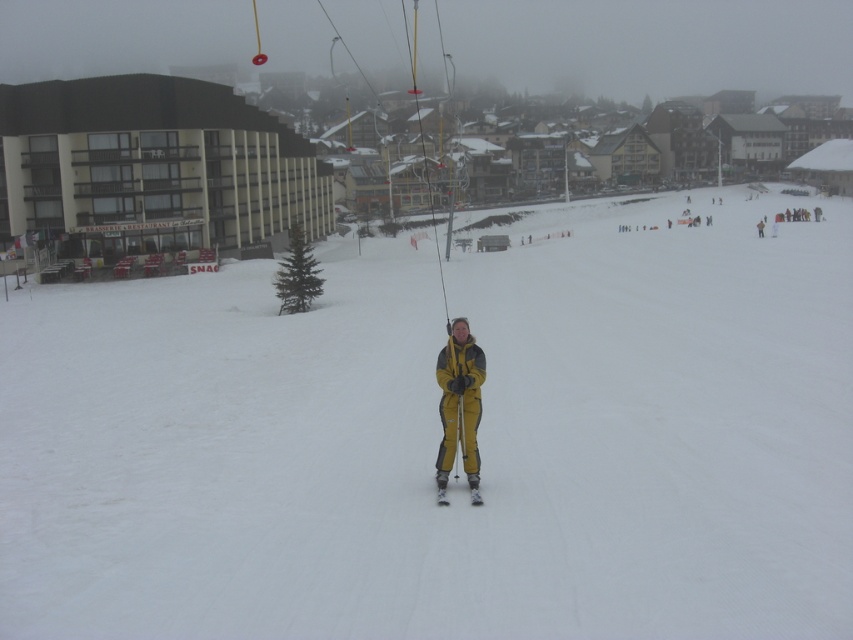
Question: Does beige concrete building at upper left have a lesser width compared to yellow matte ski at center?

Choices:
 (A) yes
 (B) no

Answer: (B)

Question: Is white snow ski slope at center below yellow matte ski at center?

Choices:
 (A) no
 (B) yes

Answer: (A)

Question: Which object is farther from the camera taking this photo?

Choices:
 (A) yellow matte ski at center
 (B) white snow ski slope at center

Answer: (A)

Question: Which of the following is the farthest from the observer?

Choices:
 (A) (842, 220)
 (B) (85, 90)

Answer: (A)

Question: Can you confirm if beige concrete building at upper left is positioned to the right of yellow matte ski suit at center?

Choices:
 (A) yes
 (B) no

Answer: (B)

Question: Among these objects, which one is nearest to the camera?

Choices:
 (A) beige concrete building at upper left
 (B) yellow matte ski at center

Answer: (B)